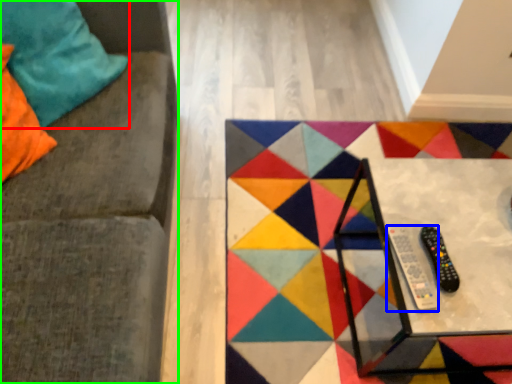
Question: Which is nearer to the pillow (highlighted by a red box)? remote (highlighted by a blue box) or furniture (highlighted by a green box).

Choices:
 (A) remote
 (B) furniture

Answer: (B)